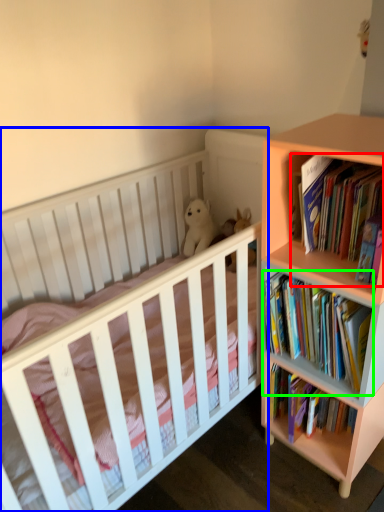
Question: Estimate the real-world distances between objects in this image. Which object is farther from book (highlighted by a red box), infant bed (highlighted by a blue box) or book (highlighted by a green box)?

Choices:
 (A) infant bed
 (B) book

Answer: (A)